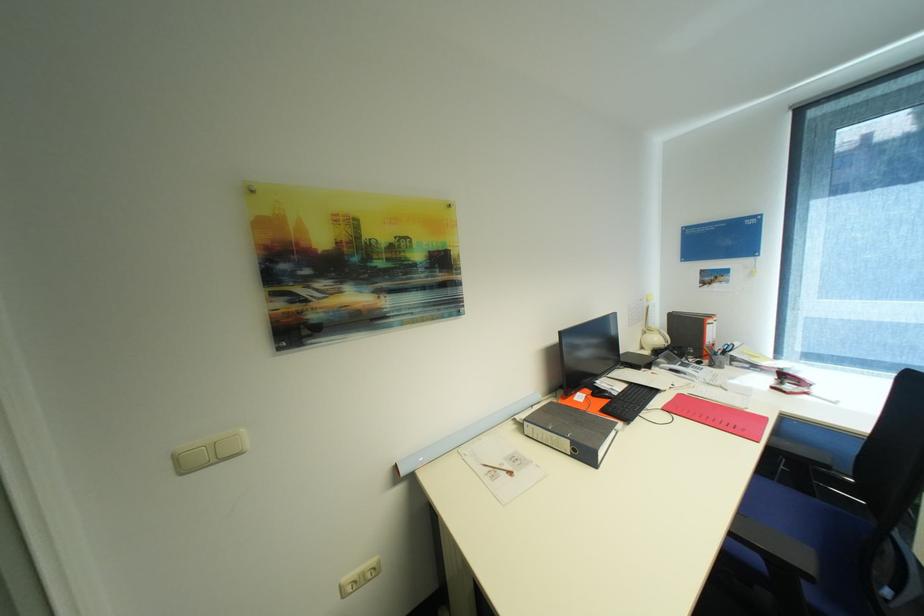
Describe the element at coordinates (796, 384) in the screenshot. I see `the pair of scissors` at that location.